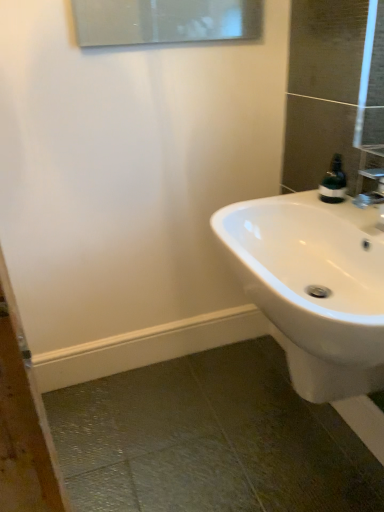
Question: Is white glossy sink at lower right inside or outside of green matte soap dispenser at upper right?

Choices:
 (A) outside
 (B) inside

Answer: (A)

Question: From a real-world perspective, relative to green matte soap dispenser at upper right, is white glossy sink at lower right vertically above or below?

Choices:
 (A) below
 (B) above

Answer: (A)

Question: From the image's perspective, relative to green matte soap dispenser at upper right, is white glossy sink at lower right above or below?

Choices:
 (A) above
 (B) below

Answer: (B)

Question: Is point (331, 183) positioned closer to the camera than point (349, 368)?

Choices:
 (A) farther
 (B) closer

Answer: (A)

Question: Is green matte soap dispenser at upper right bigger or smaller than white glossy sink at lower right?

Choices:
 (A) small
 (B) big

Answer: (A)

Question: Is green matte soap dispenser at upper right taller or shorter than white glossy sink at lower right?

Choices:
 (A) tall
 (B) short

Answer: (B)

Question: From the image's perspective, relative to white glossy sink at lower right, is green matte soap dispenser at upper right above or below?

Choices:
 (A) below
 (B) above

Answer: (B)